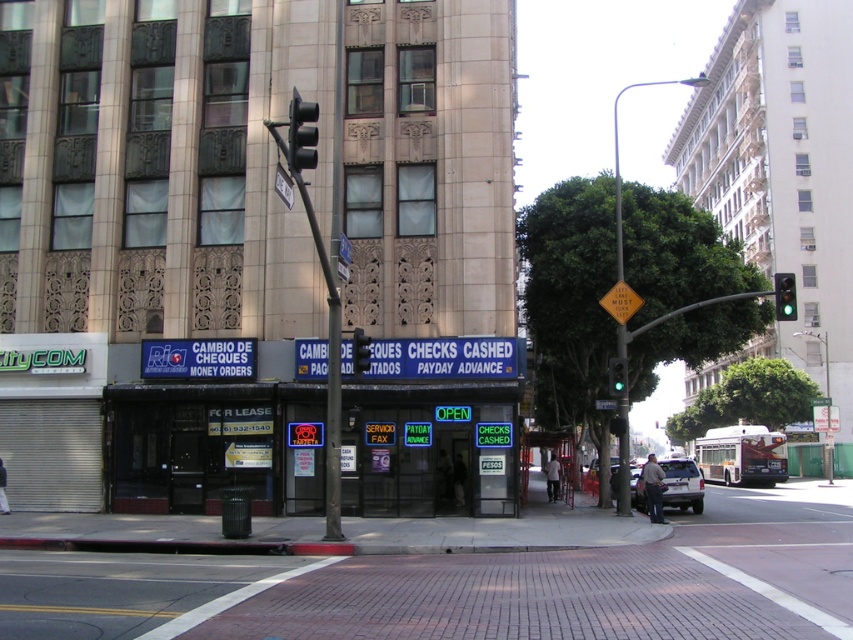
Question: Which of the following is the farthest from the observer?

Choices:
 (A) (786, 305)
 (B) (676, 481)

Answer: (B)

Question: Which object appears closest to the camera in this image?

Choices:
 (A) metallic traffic light at center
 (B) green glass traffic light at upper right
 (C) silver metallic suv at center

Answer: (A)

Question: Observing the image, what is the correct spatial positioning of black plastic traffic light at upper center in reference to green glass traffic light at center?

Choices:
 (A) left
 (B) right

Answer: (A)

Question: Can you confirm if green glass traffic light at upper right is thinner than metallic traffic light at center?

Choices:
 (A) no
 (B) yes

Answer: (A)

Question: Does brick pavement at lower center appear over metallic traffic light at center?

Choices:
 (A) no
 (B) yes

Answer: (A)

Question: Considering the real-world distances, which object is farthest from the black plastic traffic light at upper center?

Choices:
 (A) metallic traffic light at center
 (B) silver metallic suv at center
 (C) green glass traffic light at center
 (D) brick pavement at lower center

Answer: (B)